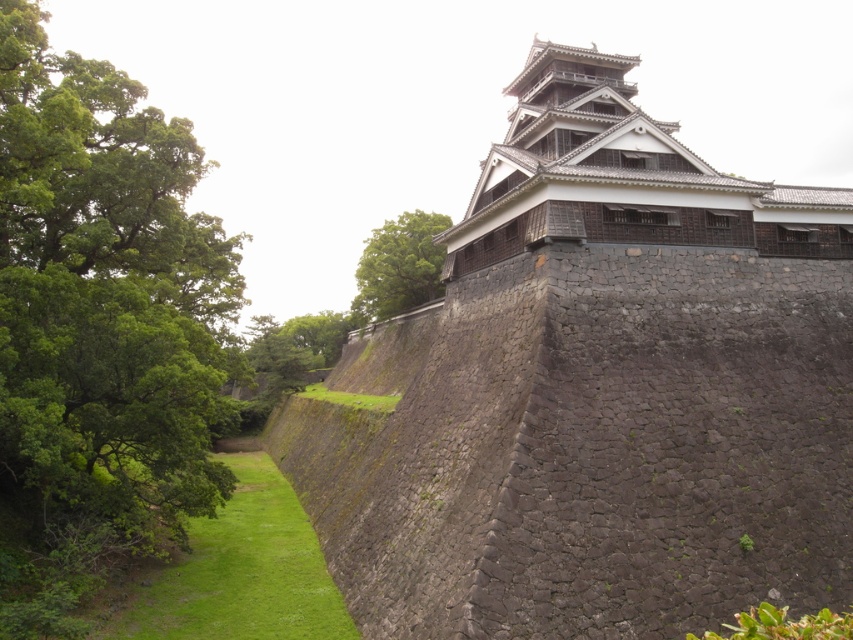
Question: Considering the relative positions of dark gray stone tower at upper center and green leafy tree at upper center in the image provided, where is dark gray stone tower at upper center located with respect to green leafy tree at upper center?

Choices:
 (A) below
 (B) above

Answer: (A)

Question: Based on their relative distances, which object is nearer to the dark gray stone tower at upper center?

Choices:
 (A) green leafy tree at left
 (B) green leafy tree at upper center

Answer: (A)

Question: Can you confirm if green leafy tree at left is thinner than green leafy tree at upper center?

Choices:
 (A) no
 (B) yes

Answer: (B)

Question: Which of the following is the farthest from the observer?

Choices:
 (A) (670, 221)
 (B) (375, 300)
 (C) (178, 401)

Answer: (B)

Question: Which of these objects is positioned farthest from the green leafy tree at upper center?

Choices:
 (A) green leafy tree at left
 (B) dark gray stone tower at upper center

Answer: (B)

Question: Does green leafy tree at left have a smaller size compared to green leafy tree at upper center?

Choices:
 (A) no
 (B) yes

Answer: (B)